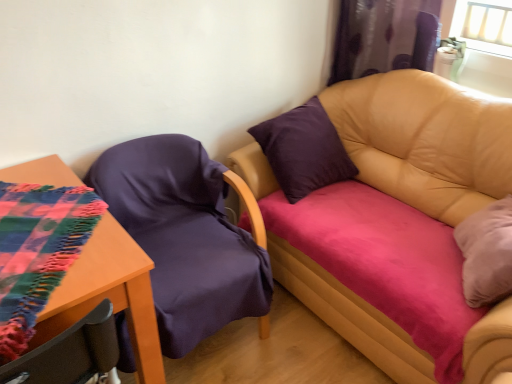
You are a GUI agent. You are given a task and a screenshot of the screen. Output one action in this format:
    pyautogui.click(x=<x>, y=<y>)
    Task: Click on the purple satin curtain at upper right
    Image resolution: width=512 pixels, height=384 pixels.
    Given the screenshot: What is the action you would take?
    pyautogui.click(x=385, y=37)

The height and width of the screenshot is (384, 512). What do you see at coordinates (109, 295) in the screenshot?
I see `wooden table at lower left` at bounding box center [109, 295].

Where is `purple satin curtain at upper right`? purple satin curtain at upper right is located at coordinates (385, 37).

Does wooden table at lower left turn towards leather couch at upper right?

No, wooden table at lower left does not turn towards leather couch at upper right.

How distant is wooden table at lower left from leather couch at upper right?

They are 1.27 meters apart.

Does wooden table at lower left have a greater height compared to leather couch at upper right?

No.

Does point (110, 235) come closer to viewer compared to point (476, 94)?

That is True.

From a real-world perspective, is leather couch at upper right physically above purple fabric chair at left?

Yes, from a real-world perspective, leather couch at upper right is above purple fabric chair at left.

Relative to purple fabric chair at left, is leather couch at upper right in front or behind?

Clearly, leather couch at upper right is in front of purple fabric chair at left.

Is leather couch at upper right beside purple fabric chair at left?

leather couch at upper right and purple fabric chair at left are clearly separated.

Considering the sizes of objects leather couch at upper right and purple fabric chair at left in the image provided, who is taller, leather couch at upper right or purple fabric chair at left?

Standing taller between the two is leather couch at upper right.

From the image's perspective, is purple satin curtain at upper right positioned above or below purple fabric chair at left?

Clearly, from the image's perspective, purple satin curtain at upper right is above purple fabric chair at left.

Which object is closer to the camera, purple satin curtain at upper right or purple fabric chair at left?

purple fabric chair at left is in front.

Measure the distance from purple satin curtain at upper right to purple fabric chair at left.

purple satin curtain at upper right is 1.11 meters from purple fabric chair at left.

How different are the orientations of purple satin curtain at upper right and purple fabric chair at left in degrees?

There is a 78.3-degree angle between the facing directions of purple satin curtain at upper right and purple fabric chair at left.

How different are the orientations of wooden table at lower left and purple fabric chair at left in degrees?

They differ by 173 degrees in their facing directions.

Based on their sizes in the image, would you say wooden table at lower left is bigger or smaller than purple fabric chair at left?

Clearly, wooden table at lower left is smaller in size than purple fabric chair at left.

Measure the distance from wooden table at lower left to purple fabric chair at left.

wooden table at lower left and purple fabric chair at left are 13.14 inches apart.

Which is in front, wooden table at lower left or purple fabric chair at left?

wooden table at lower left is in front.

Does purple fabric chair at left have a smaller size compared to wooden table at lower left?

No, purple fabric chair at left is not smaller than wooden table at lower left.

Which point is more forward, (192, 216) or (146, 342)?

The point (146, 342) is more forward.

Is purple fabric chair at left positioned far away from wooden table at lower left?

That's not correct — purple fabric chair at left is a little close to wooden table at lower left.

Can you confirm if leather couch at upper right is smaller than wooden table at lower left?

Incorrect, leather couch at upper right is not smaller in size than wooden table at lower left.

Who is shorter, leather couch at upper right or wooden table at lower left?

With less height is wooden table at lower left.

Is point (489, 369) farther from viewer compared to point (115, 234)?

Yes, it is behind point (115, 234).

From the image's perspective, is leather couch at upper right located above or below wooden table at lower left?

From the image's perspective, leather couch at upper right appears above wooden table at lower left.

From a real-world perspective, is wooden table at lower left located higher than purple satin curtain at upper right?

No, from a real-world perspective, wooden table at lower left is not above purple satin curtain at upper right.

Choose the correct answer: Is wooden table at lower left inside purple satin curtain at upper right or outside it?

wooden table at lower left cannot be found inside purple satin curtain at upper right.

Is wooden table at lower left aimed at purple satin curtain at upper right?

No, wooden table at lower left is not facing towards purple satin curtain at upper right.

Identify the location of table on the left of leather couch at upper right. This screenshot has width=512, height=384. (109, 295).

Identify the location of studio couch in front of the purple fabric chair at left. (425, 139).

Looking at the image, which one is located closer to leather couch at upper right, purple satin curtain at upper right or purple fabric chair at left?

The object closer to leather couch at upper right is purple satin curtain at upper right.

Based on their spatial positions, is leather couch at upper right or purple satin curtain at upper right further from wooden table at lower left?

Based on the image, purple satin curtain at upper right appears to be further to wooden table at lower left.

Estimate the real-world distances between objects in this image. Which object is closer to purple fabric chair at left, wooden table at lower left or purple satin curtain at upper right?

wooden table at lower left is closer to purple fabric chair at left.

Which object lies further to the anchor point wooden table at lower left, purple fabric chair at left or leather couch at upper right?

leather couch at upper right.

When comparing their distances from purple satin curtain at upper right, does wooden table at lower left or leather couch at upper right seem further?

The object further to purple satin curtain at upper right is wooden table at lower left.

When comparing their distances from purple fabric chair at left, does leather couch at upper right or purple satin curtain at upper right seem closer?

leather couch at upper right is positioned closer to the anchor purple fabric chair at left.

Which object lies nearer to the anchor point purple satin curtain at upper right, purple fabric chair at left or wooden table at lower left?

purple fabric chair at left is closer to purple satin curtain at upper right.

Based on the photo, based on their spatial positions, is purple fabric chair at left or purple satin curtain at upper right closer to leather couch at upper right?

Among the two, purple satin curtain at upper right is located nearer to leather couch at upper right.

Where is `studio couch between wooden table at lower left and purple satin curtain at upper right from left to right`? The image size is (512, 384). studio couch between wooden table at lower left and purple satin curtain at upper right from left to right is located at coordinates (425, 139).

Where is `studio couch between purple fabric chair at left and purple satin curtain at upper right from left to right`? This screenshot has width=512, height=384. studio couch between purple fabric chair at left and purple satin curtain at upper right from left to right is located at coordinates (425, 139).

This screenshot has width=512, height=384. What are the coordinates of `chair located between wooden table at lower left and leather couch at upper right in the left-right direction` in the screenshot? It's located at (184, 236).

This screenshot has width=512, height=384. I want to click on chair that lies between purple satin curtain at upper right and wooden table at lower left from top to bottom, so click(x=184, y=236).